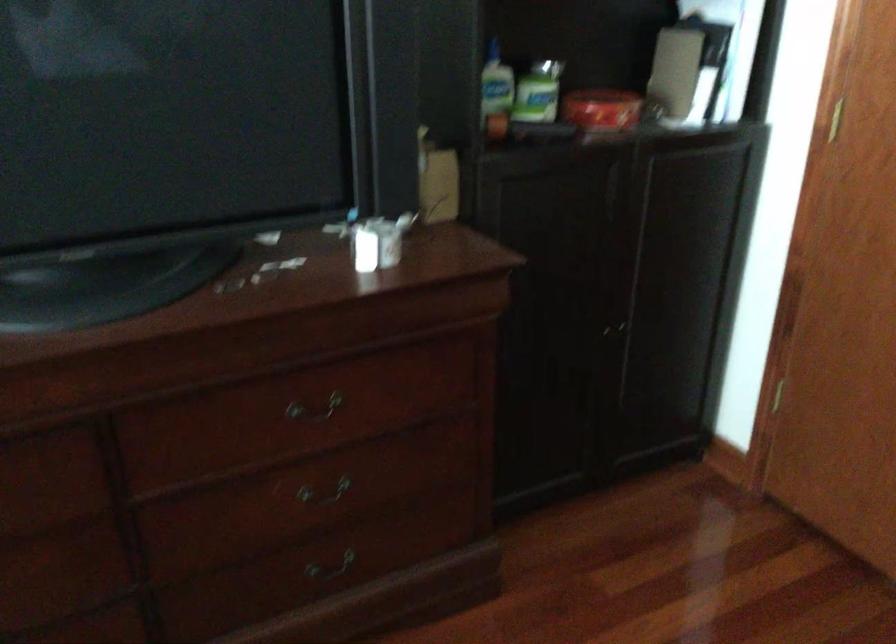
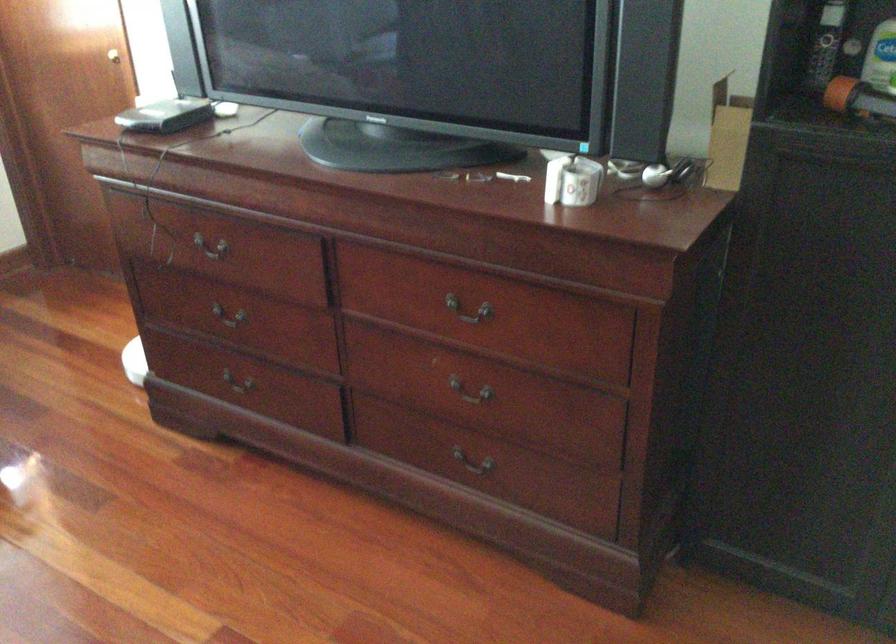
In the second image, find the point that corresponds to the point at 313,571 in the first image.

(471, 466)